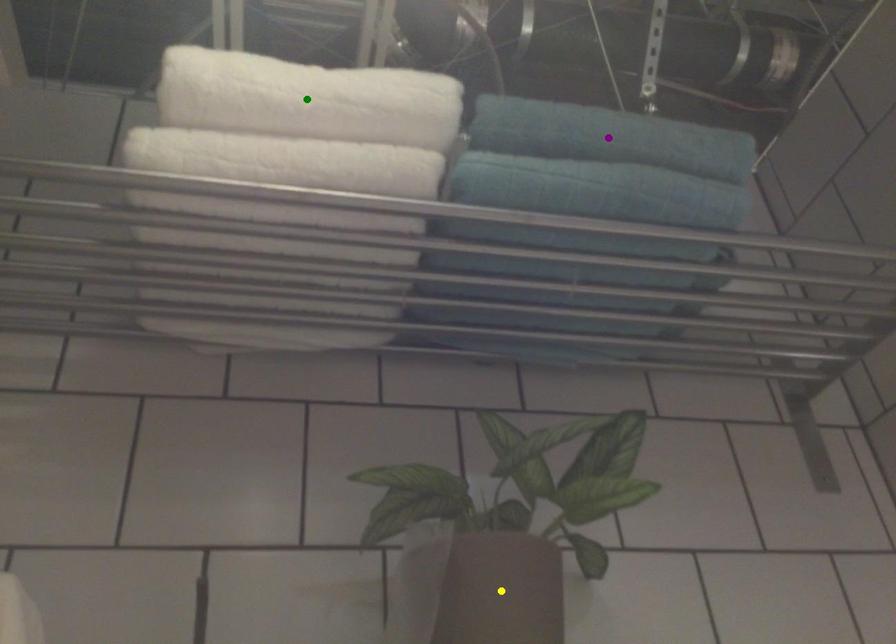
Order these from nearest to farthest:
1. green point
2. purple point
3. yellow point

yellow point, green point, purple point